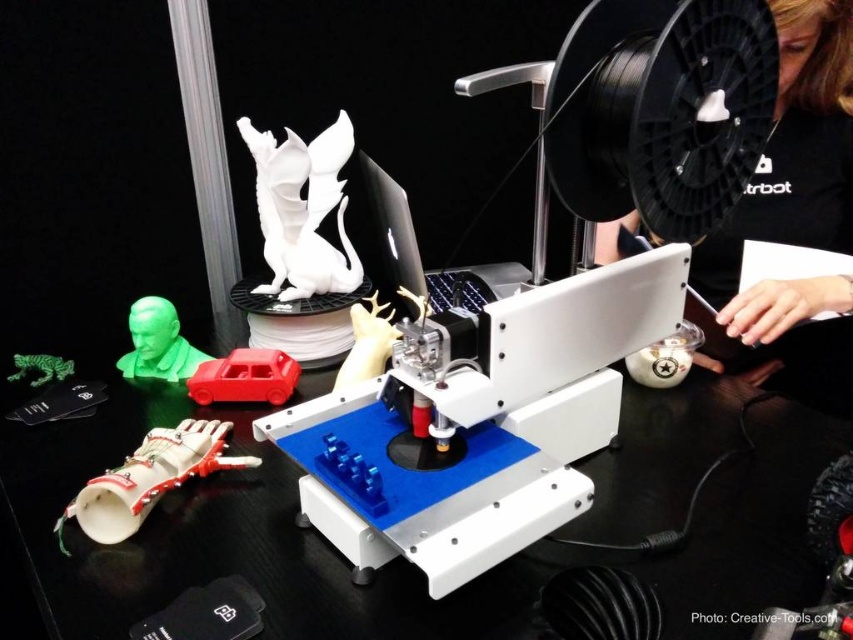
Question: Can you confirm if black glossy table at center is positioned above black matte spool at upper right?

Choices:
 (A) yes
 (B) no

Answer: (B)

Question: Which of the following is the closest to the observer?

Choices:
 (A) (85, 502)
 (B) (323, 637)
 (C) (828, 390)

Answer: (B)

Question: Which point appears closest to the camera in this image?

Choices:
 (A) (126, 356)
 (B) (828, 339)
 (C) (207, 576)
 (D) (590, 212)

Answer: (C)

Question: Is black matte spool at upper right to the right of green matte bust at center-left from the viewer's perspective?

Choices:
 (A) yes
 (B) no

Answer: (A)

Question: Is black glossy table at center to the right of white glossy dragon at center from the viewer's perspective?

Choices:
 (A) yes
 (B) no

Answer: (A)

Question: Among these objects, which one is nearest to the camera?

Choices:
 (A) matte red car at center
 (B) green matte toy car at left

Answer: (A)